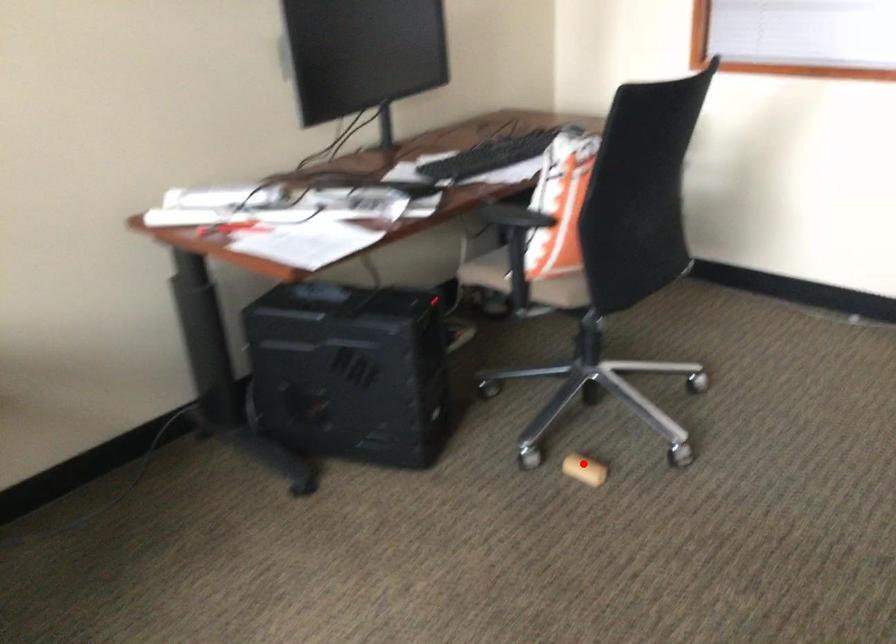
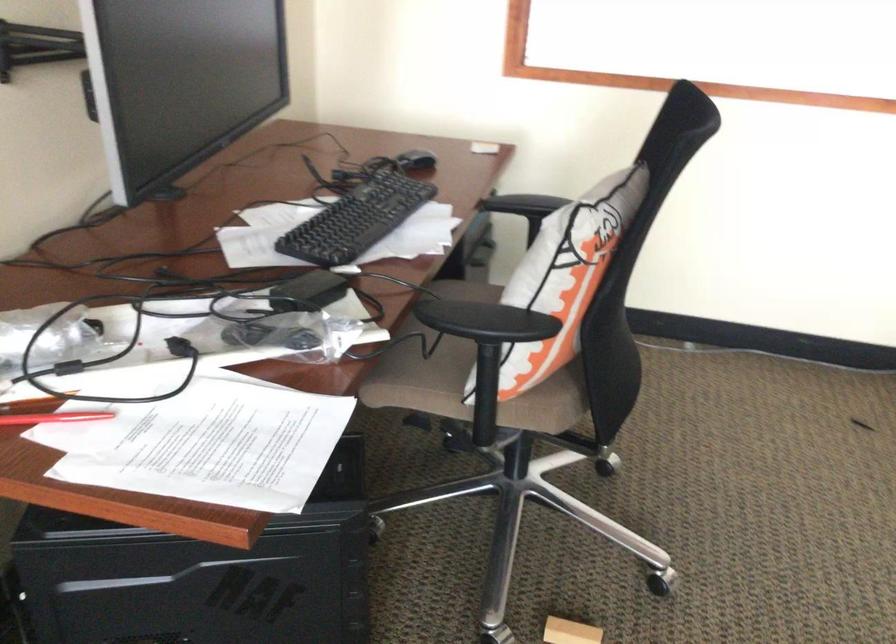
Find the pixel in the second image that matches the highlighted location in the first image.

(570, 632)